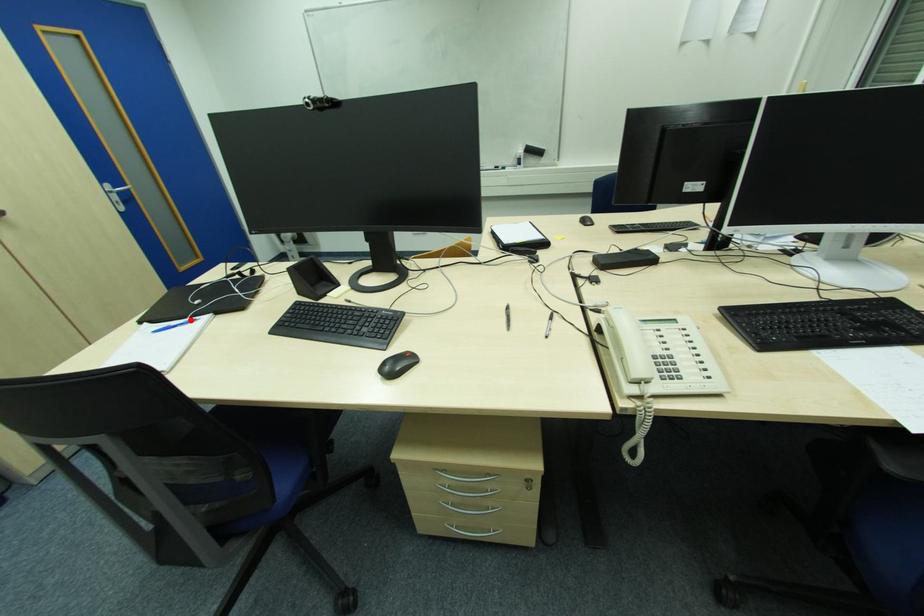
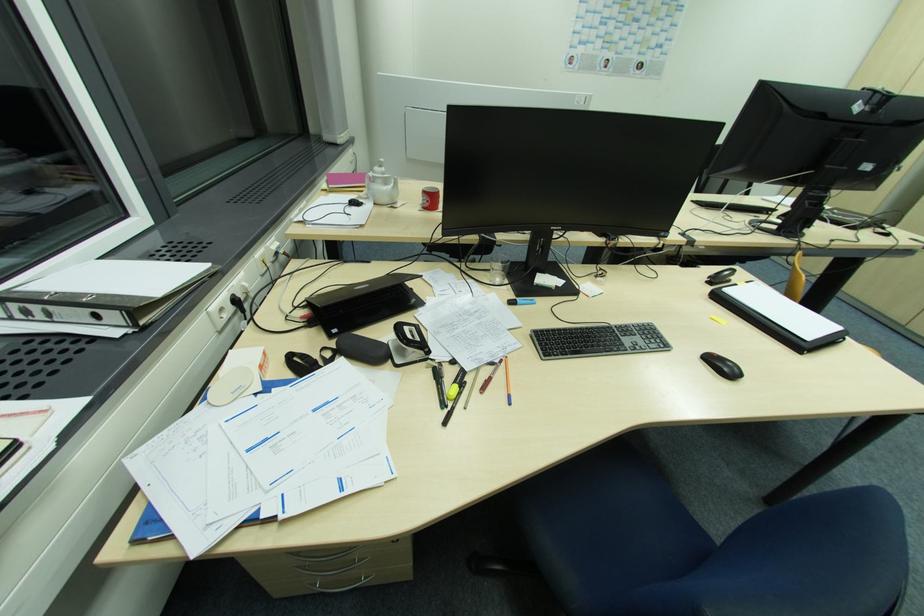
Question: I am providing you with two images of the same scene from different viewpoints. A red point is marked on the first image. At the location where the point appears in image 1, is it still visible in image 2?

Choices:
 (A) Yes
 (B) No

Answer: (B)